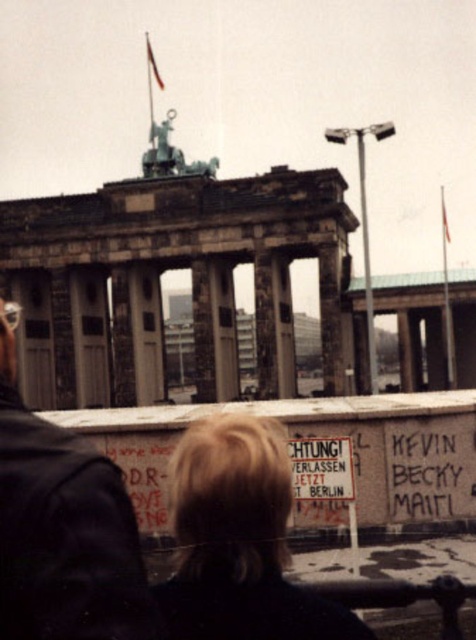
Question: Which point is farther to the camera?

Choices:
 (A) blonde hair at lower center
 (B) dark gray jacket at center

Answer: (A)

Question: Does dark gray jacket at center appear under blonde hair at lower center?

Choices:
 (A) no
 (B) yes

Answer: (A)

Question: Which point is farther to the camera?

Choices:
 (A) (175, 540)
 (B) (132, 596)

Answer: (A)

Question: Does dark gray jacket at center appear over blonde hair at lower center?

Choices:
 (A) no
 (B) yes

Answer: (B)

Question: Does dark gray jacket at center appear on the right side of blonde hair at lower center?

Choices:
 (A) yes
 (B) no

Answer: (B)